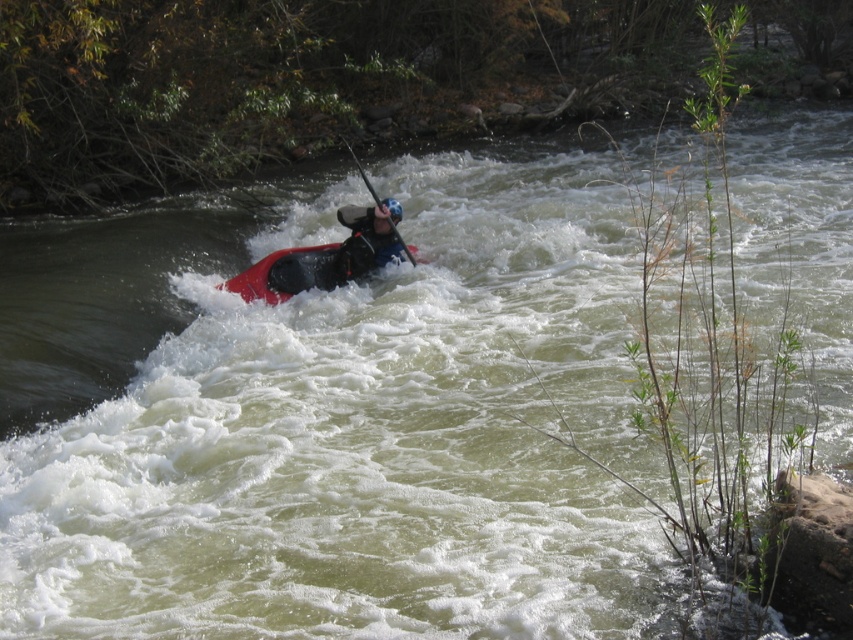
You are a photographer trying to capture the kayaker in the image. You notice the matte red kayak at center and the smooth black paddle at center. Which object should you focus on if you want to photograph the larger one?

The smooth black paddle at center is larger than the matte red kayak at center, so you should focus on the smooth black paddle at center to photograph the larger one.

You are a safety officer assessing the kayaker in the image. You notice the matte red kayak at center and the smooth black paddle at center. Based on their positions, which object is closer to the water surface?

The smooth black paddle at center is closer to the water surface because the matte red kayak at center is below it.